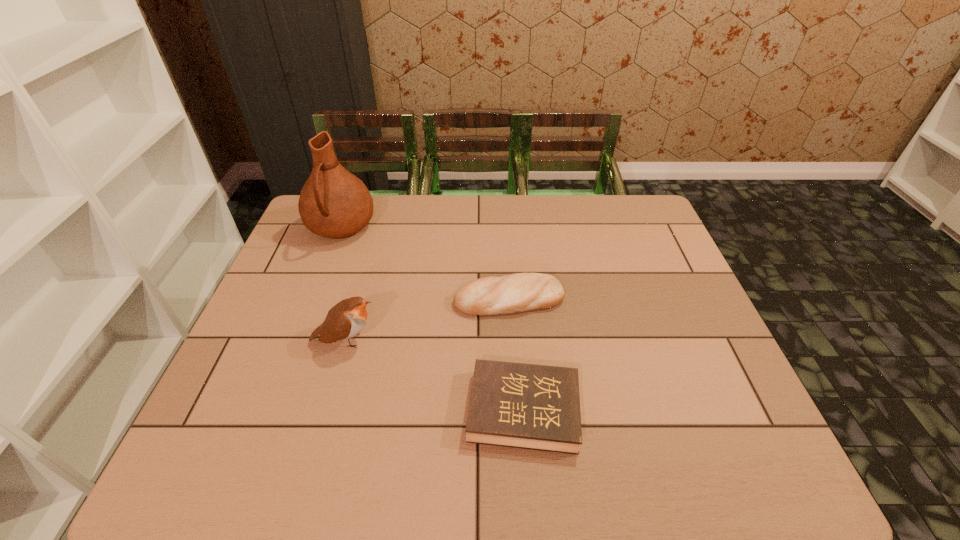
Find the location of a particular element. The image size is (960, 540). the tallest object is located at coordinates (333, 203).

Where is `the farthest object`? This screenshot has width=960, height=540. the farthest object is located at coordinates (333, 203).

This screenshot has width=960, height=540. I want to click on bird, so click(346, 319).

This screenshot has height=540, width=960. I want to click on the third shortest object, so click(346, 319).

Identify the location of the second farthest object. (519, 292).

What are the coordinates of `the second shortest object` in the screenshot? It's located at (519, 292).

Find the location of `the nearest object`. the nearest object is located at coordinates (528, 406).

Find the location of a particular element. This screenshot has width=960, height=540. hardback book is located at coordinates (528, 406).

This screenshot has width=960, height=540. Identify the location of free space located on the side of the farthest object with the handle. (323, 276).

At what (x,y) coordinates should I click in order to perform the action: click on vacant space located at the face of the bird. Please return your answer as a coordinate pair (x, y). Looking at the image, I should click on click(511, 340).